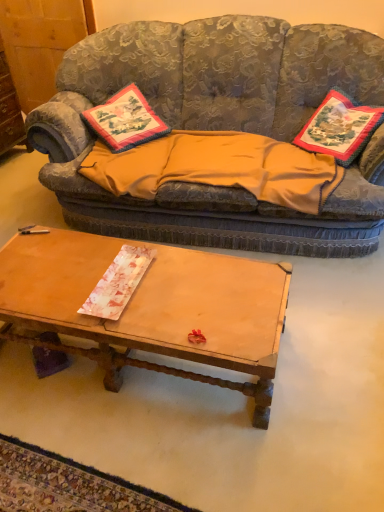
Question: Does textured fabric couch at upper center have a greater height compared to orange fabric blanket at center?

Choices:
 (A) yes
 (B) no

Answer: (A)

Question: Is orange fabric blanket at center located within textured fabric couch at upper center?

Choices:
 (A) no
 (B) yes

Answer: (B)

Question: From the image's perspective, is textured fabric couch at upper center under orange fabric blanket at center?

Choices:
 (A) yes
 (B) no

Answer: (B)

Question: Is textured fabric couch at upper center far away from orange fabric blanket at center?

Choices:
 (A) yes
 (B) no

Answer: (B)

Question: Considering the relative sizes of textured fabric couch at upper center and orange fabric blanket at center in the image provided, is textured fabric couch at upper center wider than orange fabric blanket at center?

Choices:
 (A) yes
 (B) no

Answer: (A)

Question: Considering the positions of orange fabric blanket at center and wooden coffee table at center in the image, is orange fabric blanket at center wider or thinner than wooden coffee table at center?

Choices:
 (A) wide
 (B) thin

Answer: (A)

Question: Is orange fabric blanket at center bigger or smaller than wooden coffee table at center?

Choices:
 (A) small
 (B) big

Answer: (A)

Question: Would you say orange fabric blanket at center is inside or outside wooden coffee table at center?

Choices:
 (A) inside
 (B) outside

Answer: (B)

Question: In the image, is orange fabric blanket at center positioned in front of or behind wooden coffee table at center?

Choices:
 (A) front
 (B) behind

Answer: (B)

Question: From a real-world perspective, is embroidered fabric pillow at center, placed as the second pillow when sorted from right to left, above or below embroidered fabric pillow at right, marked as the first pillow in a right-to-left arrangement?

Choices:
 (A) above
 (B) below

Answer: (B)

Question: Is embroidered fabric pillow at center, the first pillow in the left-to-right sequence, wider or thinner than embroidered fabric pillow at right, which is the 2th pillow in left-to-right order?

Choices:
 (A) thin
 (B) wide

Answer: (B)

Question: Is embroidered fabric pillow at center, the first pillow in the left-to-right sequence, in front of or behind embroidered fabric pillow at right, marked as the first pillow in a right-to-left arrangement, in the image?

Choices:
 (A) front
 (B) behind

Answer: (B)

Question: Is point (97, 128) positioned closer to the camera than point (327, 129)?

Choices:
 (A) farther
 (B) closer

Answer: (A)

Question: From their relative heights in the image, would you say embroidered fabric pillow at right, which is the 2th pillow in left-to-right order, is taller or shorter than wooden dresser at left?

Choices:
 (A) short
 (B) tall

Answer: (A)

Question: Is point (326, 116) positioned closer to the camera than point (4, 137)?

Choices:
 (A) closer
 (B) farther

Answer: (A)